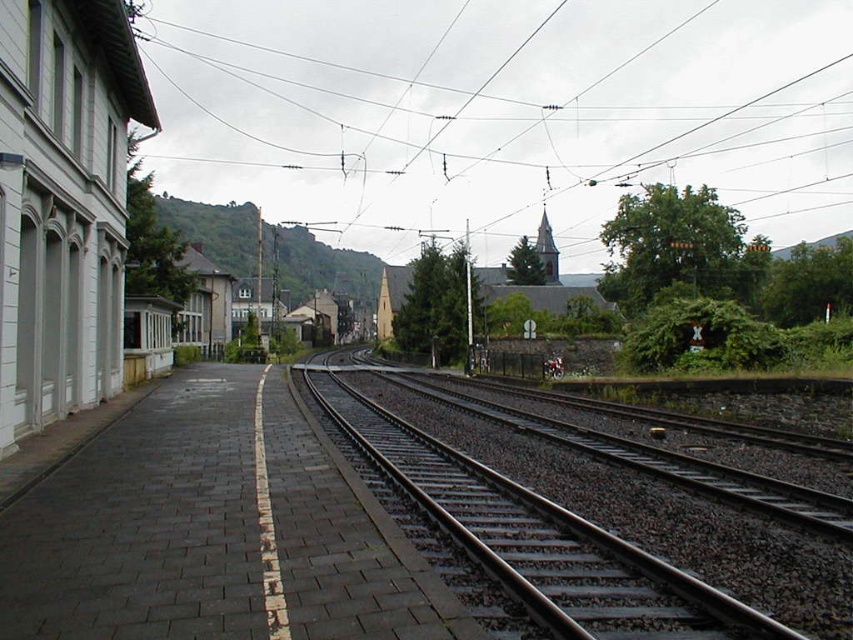
Is metallic wires at upper center smaller than black metal track at center?

Incorrect, metallic wires at upper center is not smaller in size than black metal track at center.

Can you confirm if metallic wires at upper center is positioned to the right of black metal track at center?

Indeed, metallic wires at upper center is positioned on the right side of black metal track at center.

Where is `metallic wires at upper center`? Image resolution: width=853 pixels, height=640 pixels. metallic wires at upper center is located at coordinates (503, 109).